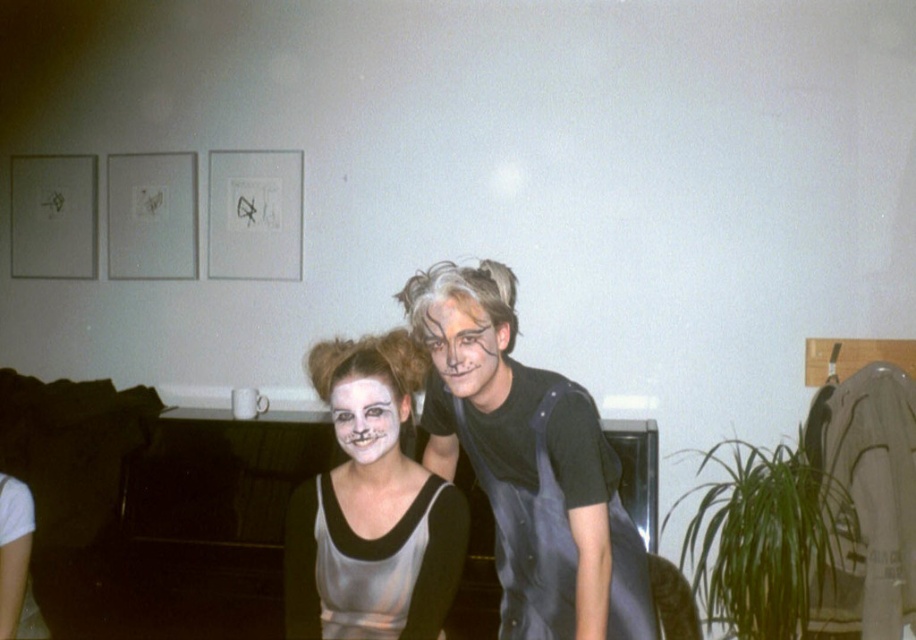
Question: Estimate the real-world distances between objects in this image. Which object is farther from the matte white face at center?

Choices:
 (A) satin silver dress at center
 (B) black matte overalls at center

Answer: (B)

Question: Does matte black face at center come behind matte white face at center?

Choices:
 (A) yes
 (B) no

Answer: (B)

Question: Can you confirm if matte black face at center is thinner than matte white face at center?

Choices:
 (A) no
 (B) yes

Answer: (A)

Question: Can you confirm if matte silver dress at center is thinner than satin silver dress at center?

Choices:
 (A) yes
 (B) no

Answer: (B)

Question: Among these objects, which one is nearest to the camera?

Choices:
 (A) matte silver dress at center
 (B) satin silver dress at center

Answer: (A)

Question: Estimate the real-world distances between objects in this image. Which object is closer to the matte silver dress at center?

Choices:
 (A) black matte overalls at center
 (B) satin silver dress at center
 (C) matte white face at center

Answer: (B)